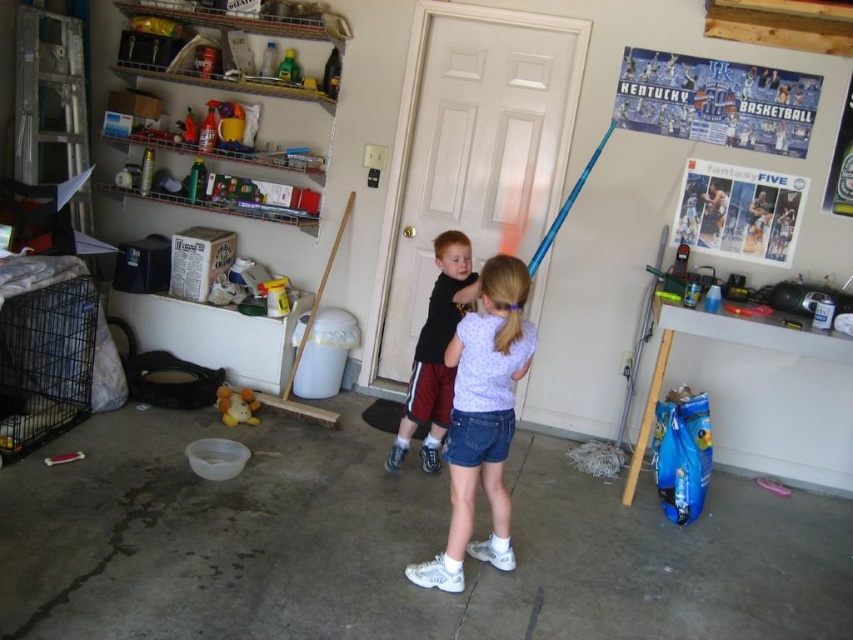
The denim shorts at center are located at coordinates point (482, 420). If you were standing in the garage, where would you look to find the denim shorts at center?

The denim shorts at center are located at the coordinates point (482, 420), so you should look towards the center of the garage to find them.

You are a parent trying to locate your children in a cluttered garage. You see the denim shorts at center and the black matte shirt at center. How far apart are these two items?

The denim shorts at center is 20.63 inches away from the black matte shirt at center.